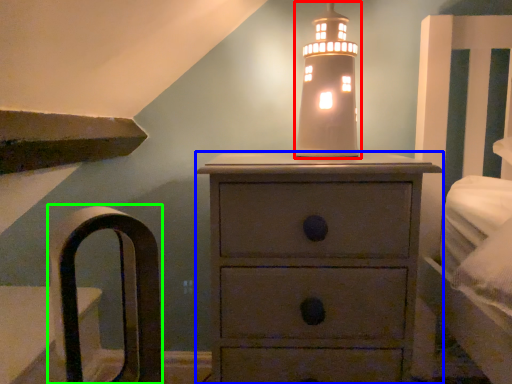
Question: Which object is the closest to the candle holder (highlighted by a red box)? Choose among these: chest of drawers (highlighted by a blue box) or armchair (highlighted by a green box).

Choices:
 (A) chest of drawers
 (B) armchair

Answer: (A)